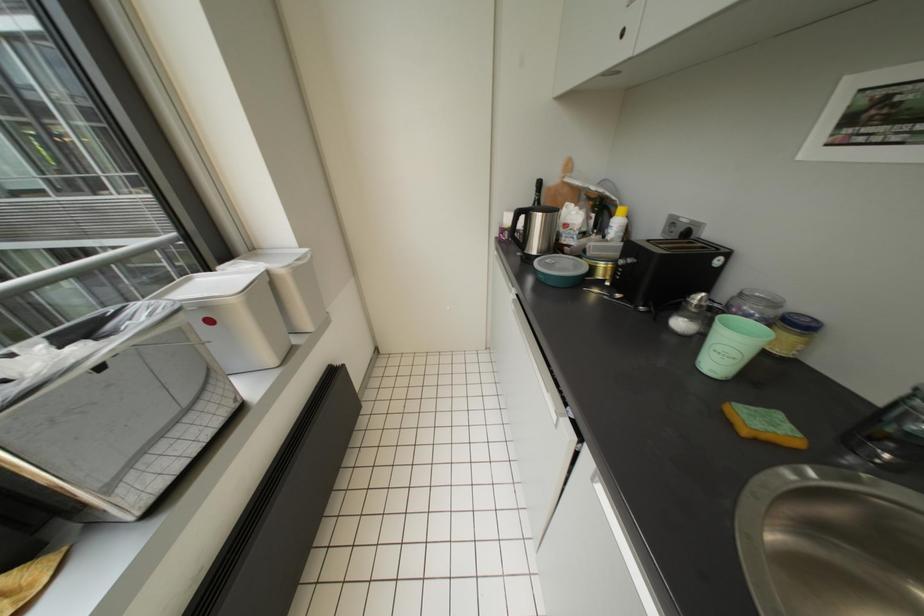
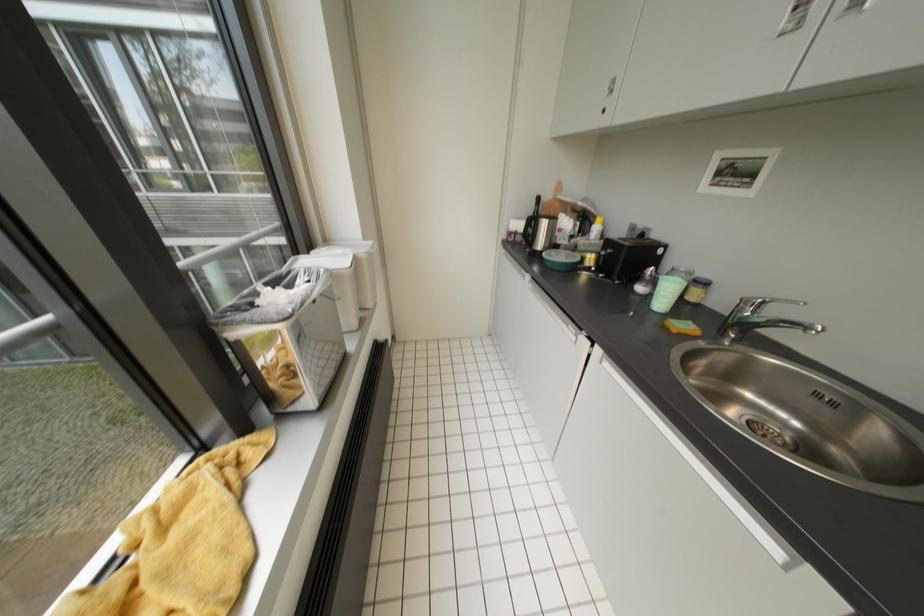
Question: The first image is from the beginning of the video and the second image is from the end. How did the camera likely rotate when shooting the video?

Choices:
 (A) Left
 (B) Right
 (C) Up
 (D) Down

Answer: (B)